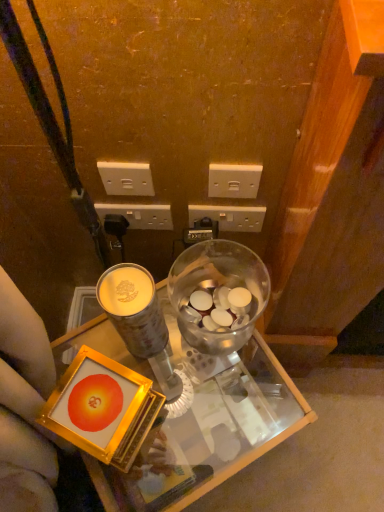
Question: Which is correct: white plastic power outlet at upper center, marked as the 1th power outlet in a left-to-right arrangement, is inside white plastic power outlet at center, which is the third power outlet from left to right, or outside of it?

Choices:
 (A) inside
 (B) outside

Answer: (B)

Question: Considering the relative positions of white plastic power outlet at upper center, placed as the 4th power outlet when sorted from right to left, and white plastic power outlet at center, the second power outlet from the right, in the image provided, is white plastic power outlet at upper center, placed as the 4th power outlet when sorted from right to left, to the left or to the right of white plastic power outlet at center, the second power outlet from the right,?

Choices:
 (A) left
 (B) right

Answer: (A)

Question: Which is farther from the white plastic power outlet at upper center, acting as the fourth power outlet starting from the left?

Choices:
 (A) white plastic power outlet at center, the second power outlet from the right
 (B) white plastic power outlet at upper center, marked as the 1th power outlet in a left-to-right arrangement
 (C) white plastic power outlet at center, the third power outlet positioned from the right
 (D) translucent glass jar at center
 (E) matte gold coffee cup at center

Answer: (E)

Question: Which of these objects is positioned farthest from the matte gold coffee cup at center?

Choices:
 (A) white plastic power outlet at center, the second power outlet from the right
 (B) white plastic power outlet at center, the third power outlet positioned from the right
 (C) transparent glass desk at center
 (D) white plastic power outlet at upper center, marked as the 1th power outlet in a left-to-right arrangement
 (E) translucent glass jar at center

Answer: (A)